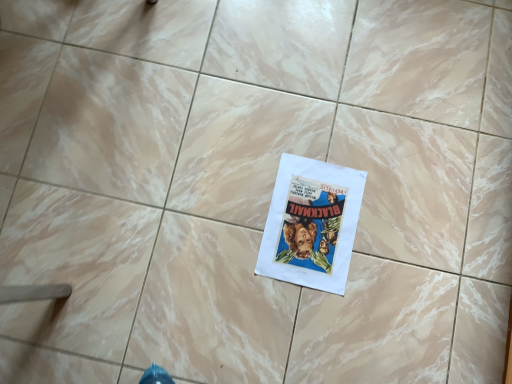
Find the location of `vacant space to the right of white paper poster at center`. vacant space to the right of white paper poster at center is located at coordinates (403, 236).